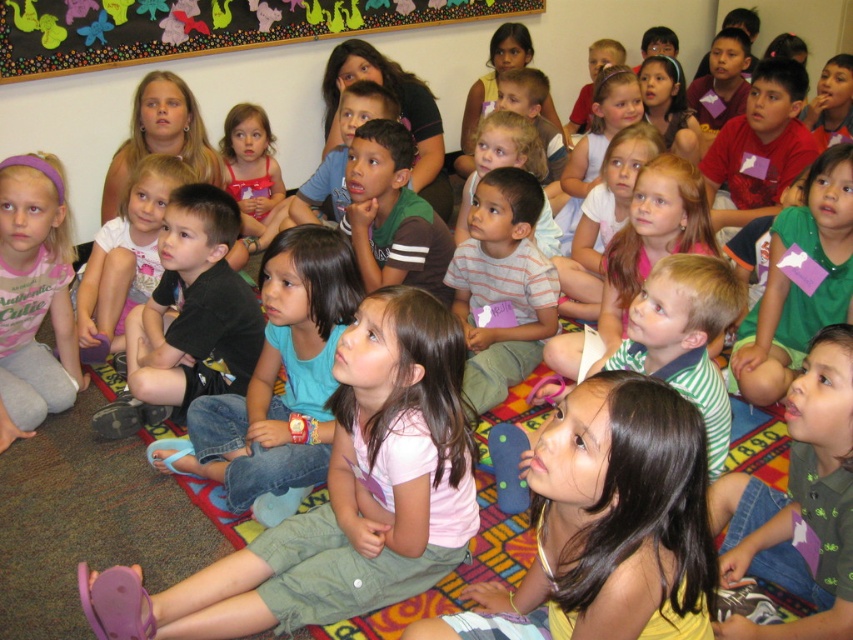
The height and width of the screenshot is (640, 853). What do you see at coordinates (358, 490) in the screenshot?
I see `pink cotton shirt at center` at bounding box center [358, 490].

Identify the location of pink cotton shirt at center. (358, 490).

Which is above, dark brown hair at center or green striped shirt at lower right?

green striped shirt at lower right

Between point (601, 550) and point (798, 579), which one is positioned behind?

The point (798, 579) is behind.

Which is behind, point (631, 392) or point (819, 611)?

The point (819, 611) is behind.

You are a GUI agent. You are given a task and a screenshot of the screen. Output one action in this format:
    pyautogui.click(x=<x>, y=<y>)
    Task: Click on the dark brown hair at center
    This screenshot has width=853, height=640.
    Given the screenshot: What is the action you would take?
    pos(610,522)

Who is more distant from viewer, [265,611] or [592,385]?

Positioned behind is point [265,611].

Where is `pink cotton shirt at center`? The width and height of the screenshot is (853, 640). pink cotton shirt at center is located at coordinates 358,490.

Find the location of a particular element. The width and height of the screenshot is (853, 640). pink cotton shirt at center is located at coordinates (358, 490).